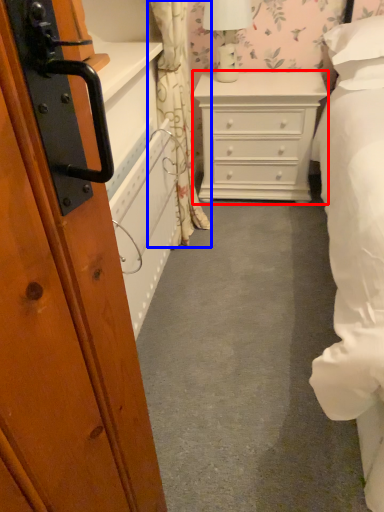
Question: Which object is closer to the camera taking this photo, chest of drawers (highlighted by a red box) or curtain (highlighted by a blue box)?

Choices:
 (A) chest of drawers
 (B) curtain

Answer: (B)